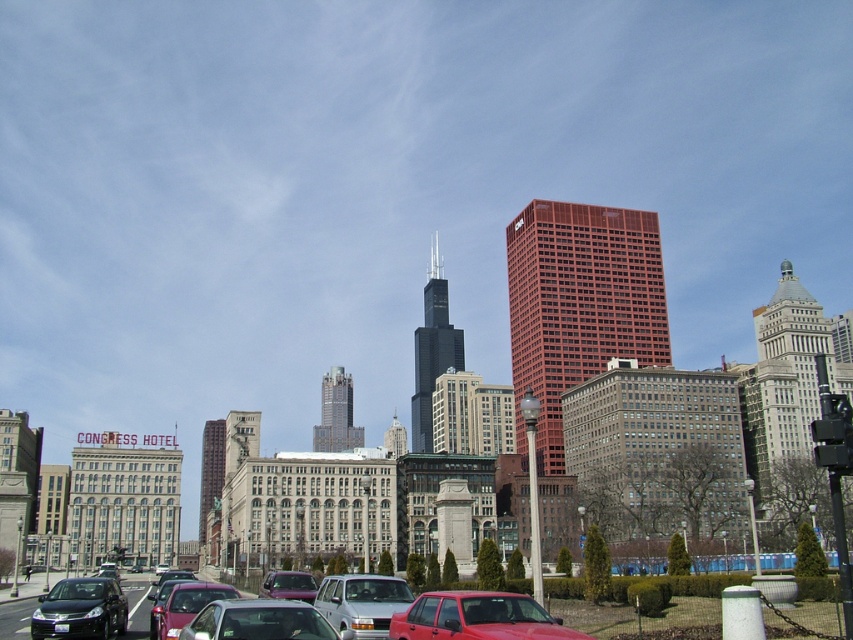
Question: Does matte red car at lower center lie behind black glass skyscraper at center?

Choices:
 (A) no
 (B) yes

Answer: (A)

Question: Is black glass skyscraper at center bigger than shiny silver skyscraper at center?

Choices:
 (A) no
 (B) yes

Answer: (B)

Question: Which of the following is the farthest from the observer?

Choices:
 (A) (440, 348)
 (B) (582, 637)
 (C) (97, 628)
 (D) (276, 572)

Answer: (A)

Question: Can you confirm if matte silver car at lower left is thinner than metallic purple car at center?

Choices:
 (A) no
 (B) yes

Answer: (A)

Question: Estimate the real-world distances between objects in this image. Which object is farther from the silver metallic van at center?

Choices:
 (A) matte red car at lower center
 (B) matte silver car at lower left

Answer: (B)

Question: Which of the following is the closest to the observer?

Choices:
 (A) shiny silver skyscraper at center
 (B) matte silver car at lower left
 (C) matte red building at center

Answer: (B)